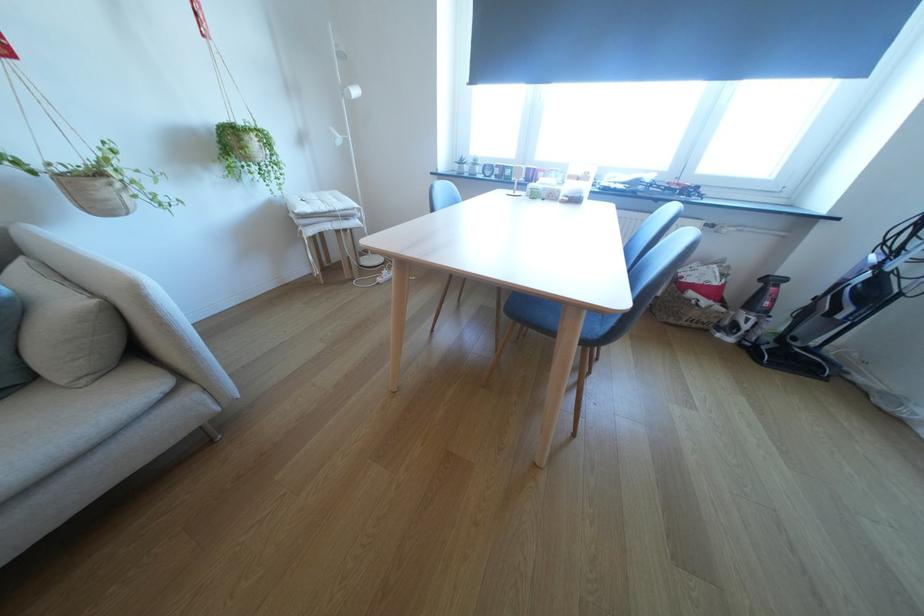
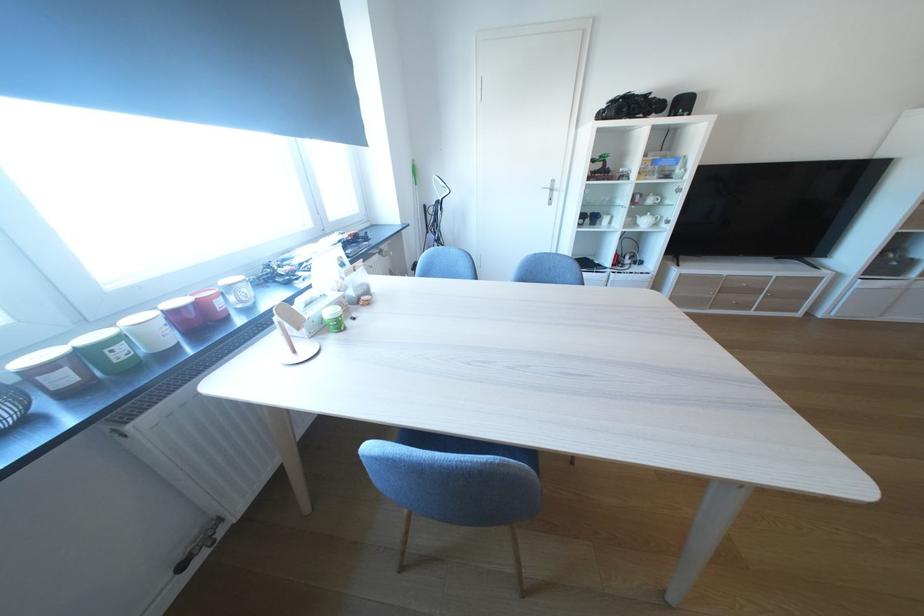
Where in the second image is the point corresponding to point (518, 174) from the first image?

(129, 354)